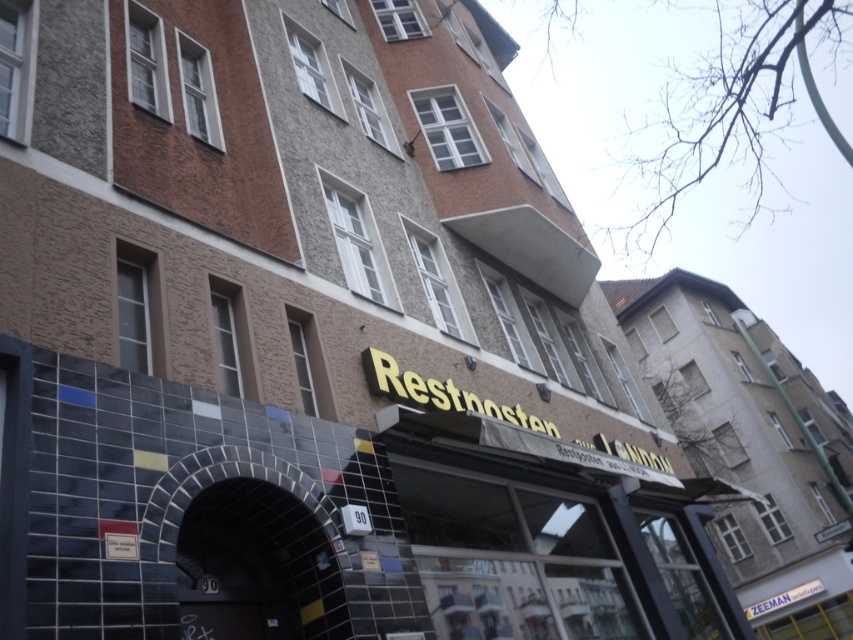
You are a delivery person approaching the building and need to locate the entrance. The entrance is marked by the black tile archway at center. However, the matte yellow sign at center is blocking your view. Can you see the entrance from your current position?

The matte yellow sign at center is taller than the black tile archway at center, so the sign is blocking the view of the entrance marked by the black tile archway at center. Therefore, you cannot see the entrance from your current position.

You are a delivery person approaching the building and need to locate the entrance. The matte yellow sign at center indicates the entrance is below it. However, the black tile archway at center is blocking your view. Can you see the entrance from your current position?

The black tile archway at center is behind matte yellow sign at center, so the entrance marked below the matte yellow sign at center should be visible as the black tile archway at center is not in front of it. However, since the black tile archway at center is behind, it does not block the view. Therefore, you can see the entrance.